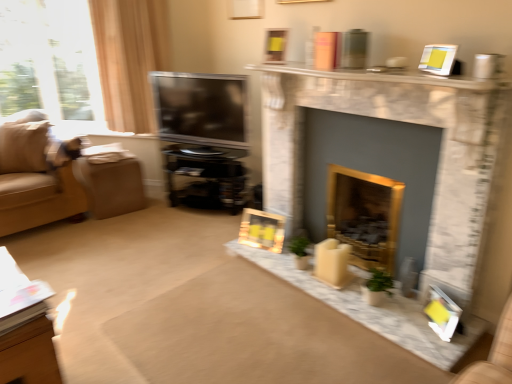
Where is `vacant space in front of black glossy entertainment center at center`? The image size is (512, 384). vacant space in front of black glossy entertainment center at center is located at coordinates point(178,236).